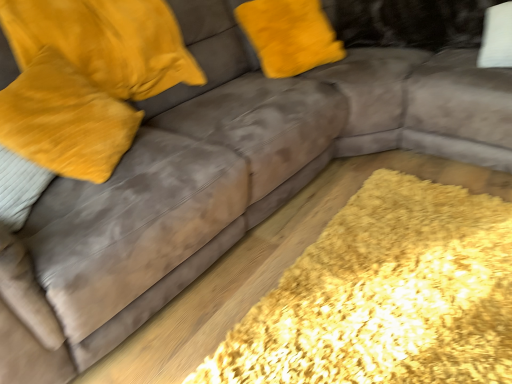
Question: Could velvet yellow pillow at upper left, the second pillow viewed from the left, be considered to be inside velvet yellow pillow at left, which is counted as the first pillow, starting from the left?

Choices:
 (A) no
 (B) yes

Answer: (A)

Question: Does velvet yellow pillow at left, acting as the 2th pillow starting from the right, turn towards velvet yellow pillow at upper left, the second pillow viewed from the left?

Choices:
 (A) no
 (B) yes

Answer: (A)

Question: Is velvet yellow pillow at left, acting as the 2th pillow starting from the right, wider than velvet yellow pillow at upper left, which appears as the 1th pillow when viewed from the right?

Choices:
 (A) yes
 (B) no

Answer: (B)

Question: Are velvet yellow pillow at left, which is counted as the first pillow, starting from the left, and velvet yellow pillow at upper left, the second pillow viewed from the left, far apart?

Choices:
 (A) yes
 (B) no

Answer: (B)

Question: Is velvet yellow pillow at left, which is counted as the first pillow, starting from the left, looking in the opposite direction of velvet yellow pillow at upper left, which appears as the 1th pillow when viewed from the right?

Choices:
 (A) no
 (B) yes

Answer: (A)

Question: Considering the relative sizes of velvet yellow pillow at left, which is counted as the first pillow, starting from the left, and velvet yellow pillow at upper left, the second pillow viewed from the left, in the image provided, is velvet yellow pillow at left, which is counted as the first pillow, starting from the left, bigger than velvet yellow pillow at upper left, the second pillow viewed from the left,?

Choices:
 (A) no
 (B) yes

Answer: (A)

Question: Is velvet yellow pillow at upper left, the second pillow viewed from the left, directly adjacent to yellow shaggy rug at lower right?

Choices:
 (A) yes
 (B) no

Answer: (B)

Question: Is velvet yellow pillow at upper left, which appears as the 1th pillow when viewed from the right, positioned with its back to yellow shaggy rug at lower right?

Choices:
 (A) yes
 (B) no

Answer: (B)

Question: Is velvet yellow pillow at upper left, the second pillow viewed from the left, bigger than yellow shaggy rug at lower right?

Choices:
 (A) yes
 (B) no

Answer: (A)

Question: Does velvet yellow pillow at upper left, which appears as the 1th pillow when viewed from the right, have a greater width compared to yellow shaggy rug at lower right?

Choices:
 (A) no
 (B) yes

Answer: (A)

Question: Is velvet yellow pillow at upper left, the second pillow viewed from the left, closer to the viewer compared to yellow shaggy rug at lower right?

Choices:
 (A) yes
 (B) no

Answer: (B)

Question: Does velvet yellow pillow at upper left, which appears as the 1th pillow when viewed from the right, contain yellow shaggy rug at lower right?

Choices:
 (A) yes
 (B) no

Answer: (B)

Question: Does yellow shaggy rug at lower right appear on the right side of velvet yellow pillow at left, acting as the 2th pillow starting from the right?

Choices:
 (A) yes
 (B) no

Answer: (A)